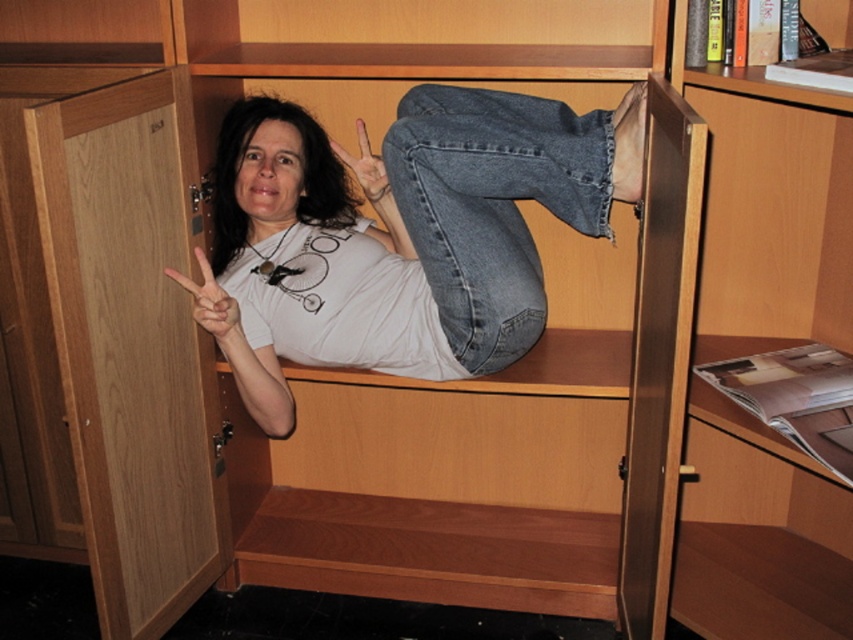
You are trying to locate the denim at center in the image. According to the coordinates provided, where exactly is the denim positioned?

The denim at center is positioned at point 0.322 on the x axis and 0.578 on the y axis.